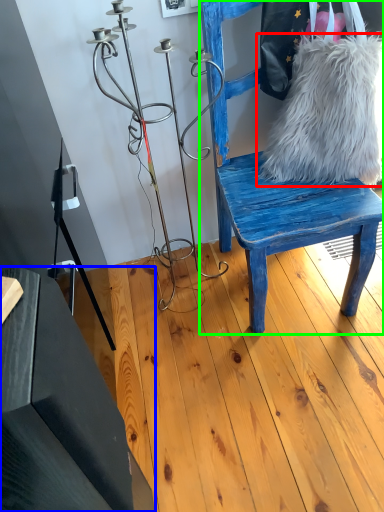
Question: Which object is the farthest from fur (highlighted by a red box)? Choose among these: table (highlighted by a blue box) or chair (highlighted by a green box).

Choices:
 (A) table
 (B) chair

Answer: (A)